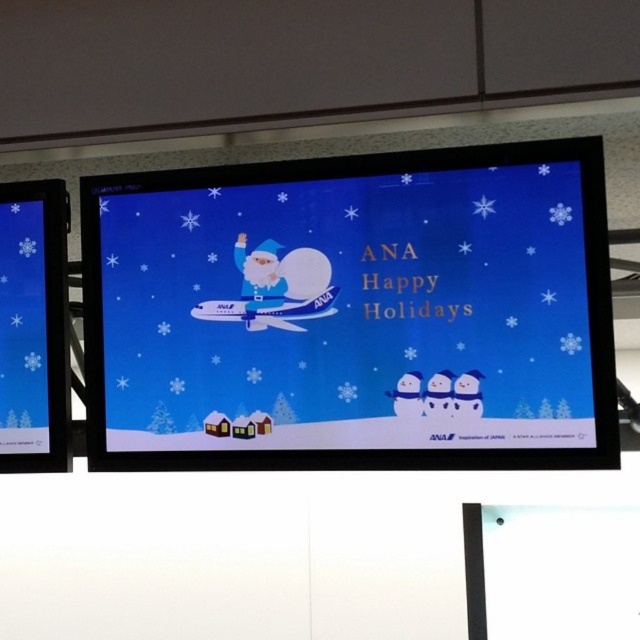
Question: Among these objects, which one is farthest from the camera?

Choices:
 (A) blue glossy screen at center
 (B) blue glossy screen at left
 (C) matte blue santa at center

Answer: (B)

Question: Estimate the real-world distances between objects in this image. Which object is farther from the blue glossy screen at center?

Choices:
 (A) matte blue santa at center
 (B) blue glossy screen at left

Answer: (B)

Question: Does blue glossy screen at center appear under matte blue santa at center?

Choices:
 (A) yes
 (B) no

Answer: (A)

Question: Is blue glossy screen at center to the right of matte blue santa at center from the viewer's perspective?

Choices:
 (A) yes
 (B) no

Answer: (A)

Question: Can you confirm if blue glossy screen at left is positioned above matte blue santa at center?

Choices:
 (A) no
 (B) yes

Answer: (A)

Question: Which object is closer to the camera taking this photo?

Choices:
 (A) blue glossy screen at center
 (B) blue glossy screen at left
 (C) matte blue santa at center

Answer: (A)